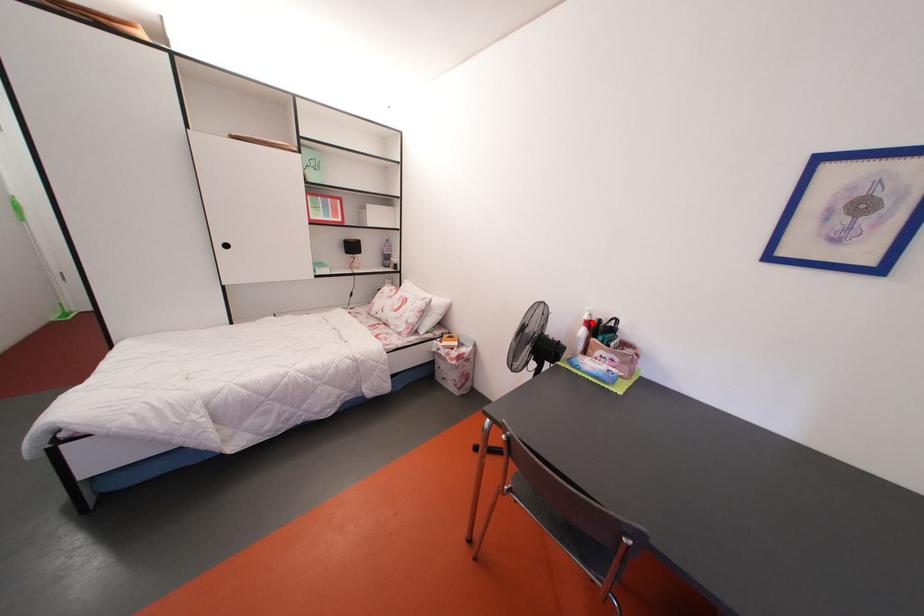
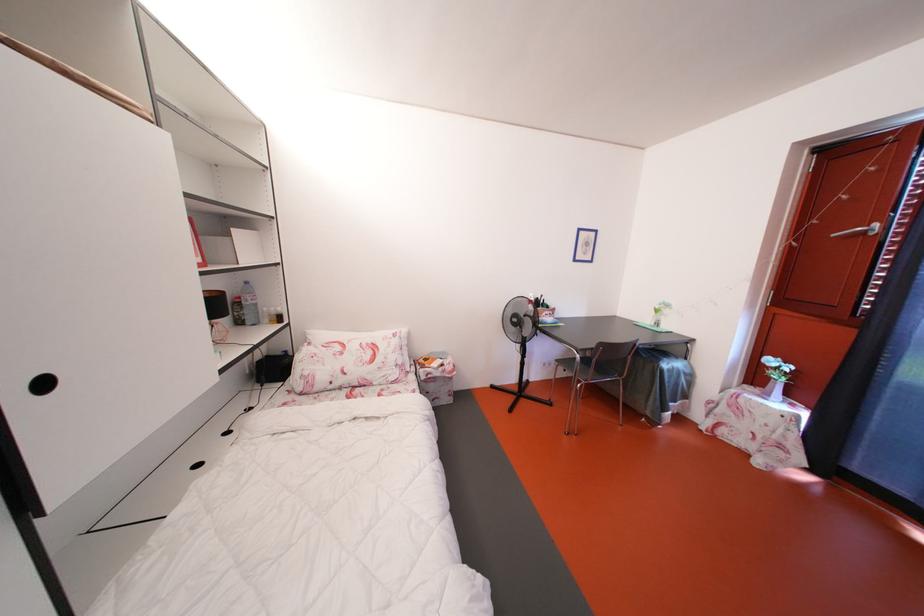
Locate, in the second image, the point that corresponds to the highlighted location in the first image.

(540, 305)